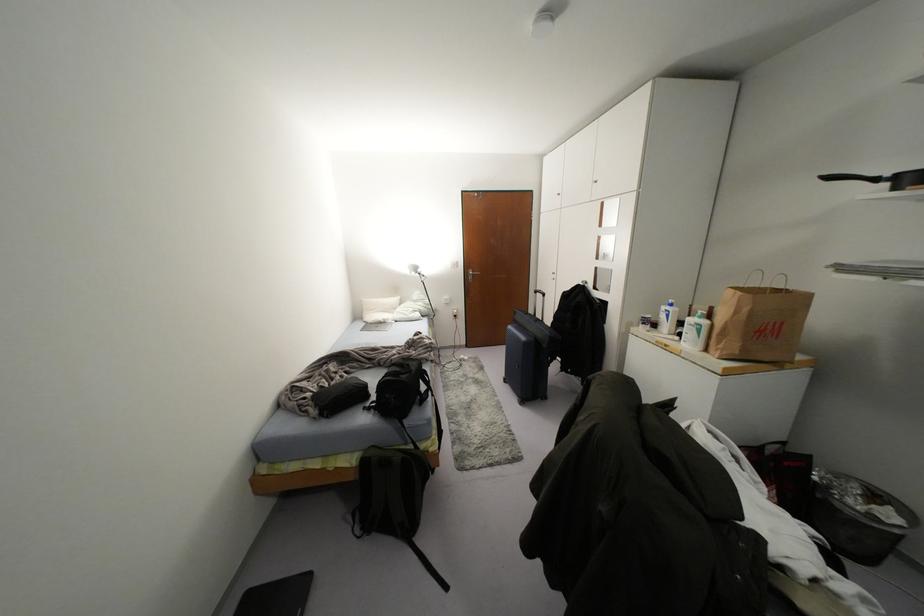
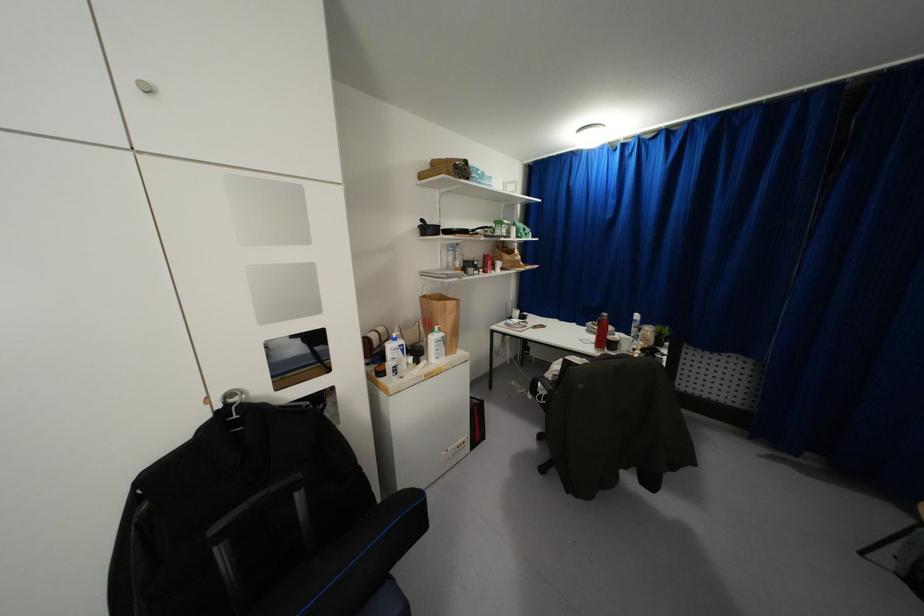
Where in the second image is the point corresponding to [666,315] from the first image?

(402, 350)